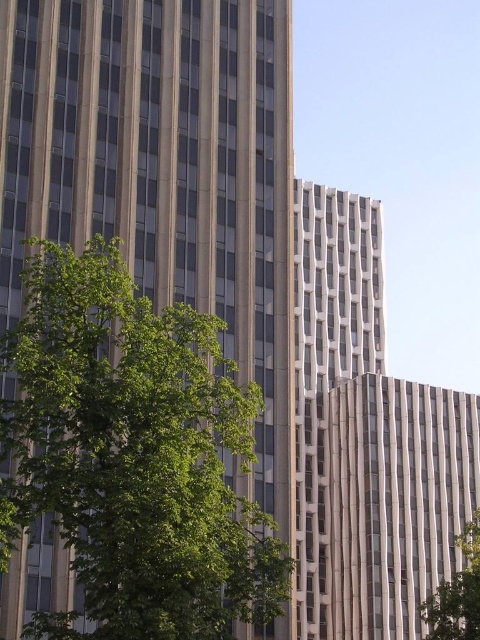
Which of these two, green leafy tree at left or green leafy tree at lower right, stands taller?

With more height is green leafy tree at left.

Is green leafy tree at left below green leafy tree at lower right?

No, green leafy tree at left is not below green leafy tree at lower right.

Is point (90, 406) positioned behind point (477, 522)?

No, it is in front of (477, 522).

This screenshot has width=480, height=640. I want to click on green leafy tree at left, so click(x=132, y=456).